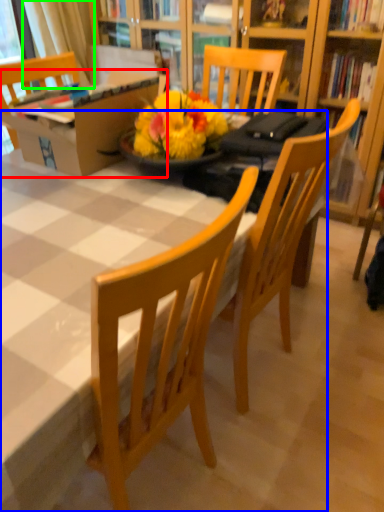
Question: Estimate the real-world distances between objects in this image. Which object is closer to box (highlighted by a red box), desk (highlighted by a blue box) or curtain (highlighted by a green box)?

Choices:
 (A) desk
 (B) curtain

Answer: (A)